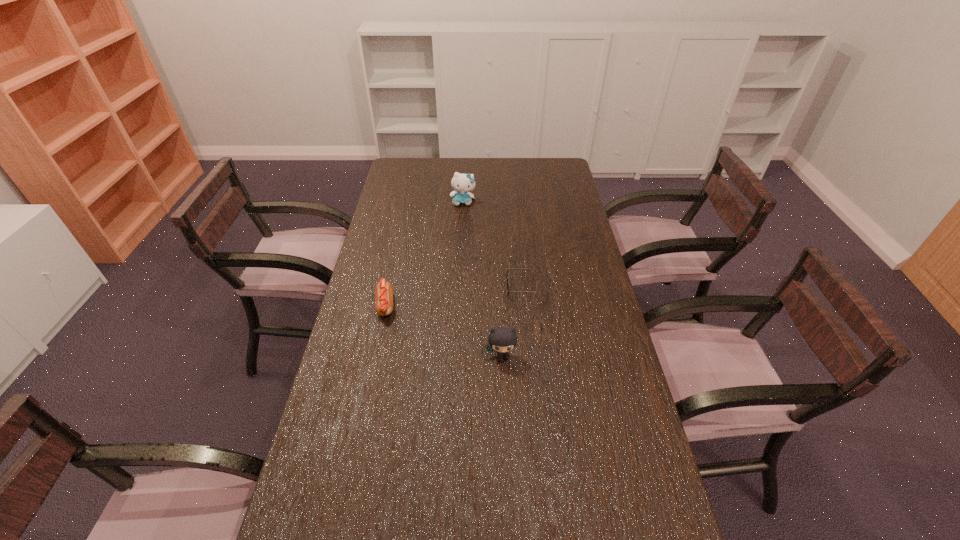
This screenshot has width=960, height=540. Identify the location of vacant space located 0.370m through the lenses of the spectacles. (400, 287).

Where is `free spot located through the lenses of the spectacles`? This screenshot has height=540, width=960. free spot located through the lenses of the spectacles is located at coordinates (412, 287).

This screenshot has height=540, width=960. Identify the location of vacant area situated through the lenses of the spectacles. (397, 287).

In order to click on object that is at the left edge in this screenshot , I will do `click(383, 291)`.

Where is `vacant point at the far edge`? vacant point at the far edge is located at coordinates (440, 169).

Identify the location of vacant area at the left edge. This screenshot has height=540, width=960. (376, 224).

In order to click on blank space at the right edge of the desktop in this screenshot , I will do `click(588, 357)`.

Where is `free space at the far right corner`? free space at the far right corner is located at coordinates (560, 163).

You are a GUI agent. You are given a task and a screenshot of the screen. Output one action in this format:
    pyautogui.click(x=<x>, y=<y>)
    Task: Click on the free space that is in between the third object from right to left and the leftmost object
    Image resolution: width=960 pixels, height=540 pixels.
    Given the screenshot: What is the action you would take?
    pyautogui.click(x=424, y=254)

Find the location of a particular element. empty space between the leftmost object and the spectacles is located at coordinates point(455,296).